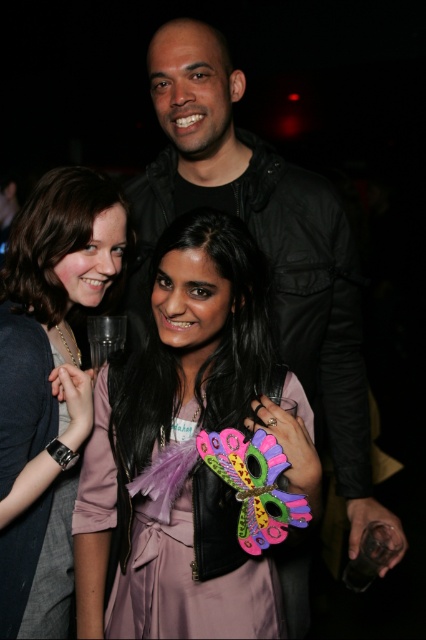
Question: Which of the following is the closest to the observer?

Choices:
 (A) pink satin dress at center
 (B) black leather jacket at upper center
 (C) matte black dress at center
 (D) matte pink dress at center

Answer: (D)

Question: Is matte black dress at center positioned in front of pink satin dress at center?

Choices:
 (A) yes
 (B) no

Answer: (A)

Question: Can you confirm if matte pink dress at center is positioned above pink satin dress at center?

Choices:
 (A) no
 (B) yes

Answer: (B)

Question: Which object is closer to the camera taking this photo?

Choices:
 (A) matte pink dress at center
 (B) matte black dress at center
 (C) pink satin dress at center

Answer: (A)

Question: Based on their relative distances, which object is nearer to the matte pink dress at center?

Choices:
 (A) black leather jacket at upper center
 (B) pink satin dress at center

Answer: (B)

Question: Can you confirm if matte black dress at center is positioned below pink satin dress at center?

Choices:
 (A) yes
 (B) no

Answer: (B)